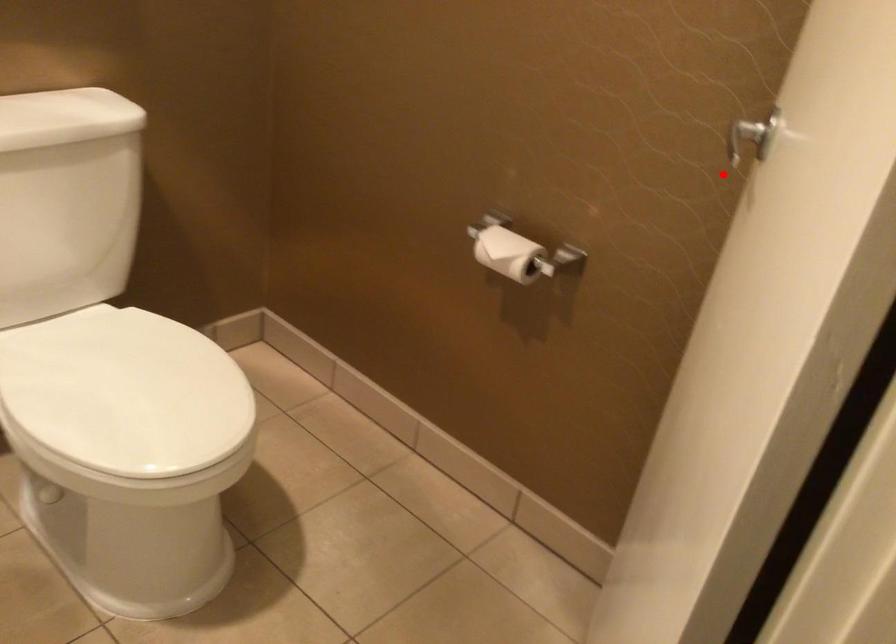
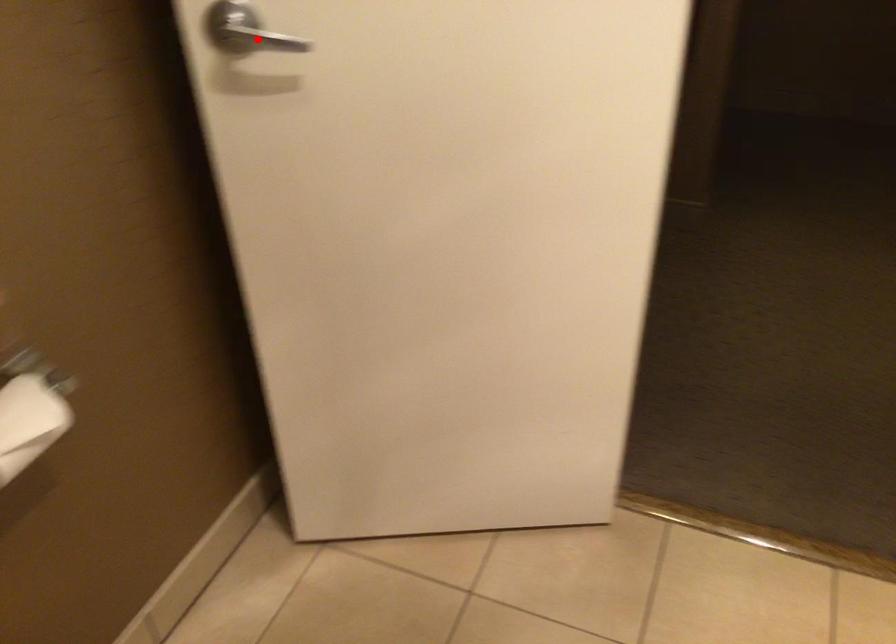
I am providing you with two images of the same scene from different viewpoints. A red point is marked on the first image and another point is marked on the second image. Is the red point in image1 aligned with the point shown in image2?

Yes